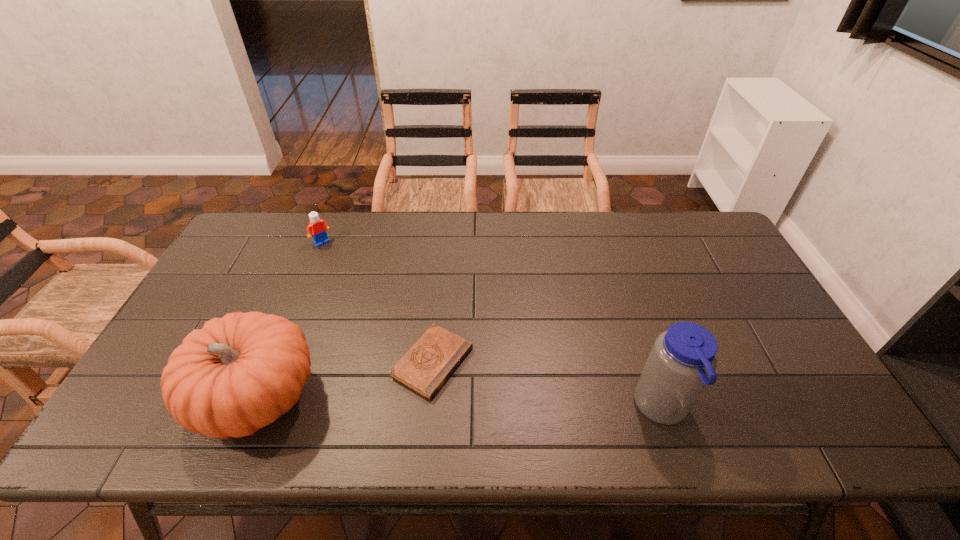
Where is `pumpkin`? The height and width of the screenshot is (540, 960). pumpkin is located at coordinates (239, 373).

The image size is (960, 540). What are the coordinates of `water bottle` in the screenshot? It's located at (683, 359).

Identify the location of the rightmost object. (683, 359).

Locate an element on the screen. The height and width of the screenshot is (540, 960). diary is located at coordinates (429, 363).

You are a GUI agent. You are given a task and a screenshot of the screen. Output one action in this format:
    pyautogui.click(x=<x>, y=<y>)
    Task: Click on the shortest object
    The image size is (960, 540).
    Given the screenshot: What is the action you would take?
    pyautogui.click(x=429, y=363)

The width and height of the screenshot is (960, 540). Find the location of `Lego`. Lego is located at coordinates (318, 228).

I want to click on the second shortest object, so click(318, 228).

At what (x,y) coordinates should I click in order to perform the action: click on blank space located 0.090m on the right of the pumpkin. Please return your answer as a coordinate pair (x, y). Looking at the image, I should click on (359, 398).

Identify the location of vacant space situated 0.120m on the spine side of the shortest object. The width and height of the screenshot is (960, 540). (508, 406).

Locate an element on the screen. The image size is (960, 540). free space located 0.060m on the spine side of the shortest object is located at coordinates (487, 394).